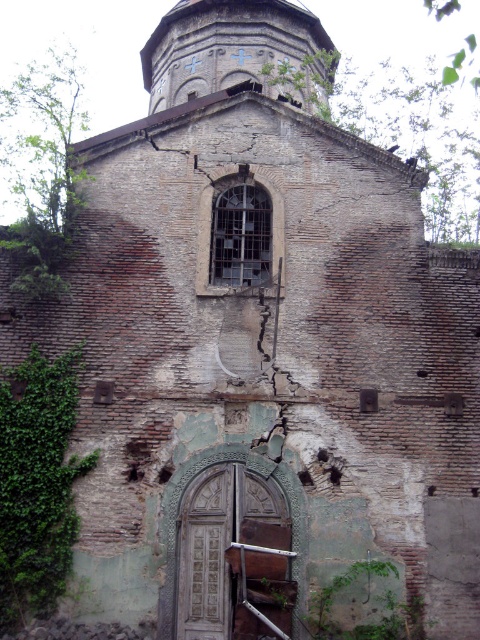
You are standing in front of the old brick building and want to enter through the wooden carved door at center. However, there is green leafy ivy at lower left blocking your path. Can you walk through the ivy to reach the door?

The green leafy ivy at lower left is located above the wooden carved door at center, so it is not blocking the path. You can walk through to reach the door.

You are standing in front of the wooden carved door at center and want to check the green leafy ivy at lower left. Which direction should you turn to see it?

The green leafy ivy at lower left is positioned on the left side of wooden carved door at center, so you should turn to your left to see it.

You are a painter who needs to decide which area to paint first between the green leafy ivy at lower left and the wooden carved door at center. Based on their sizes, which one would require more paint?

The green leafy ivy at lower left has a larger size compared to the wooden carved door at center, so it would require more paint.